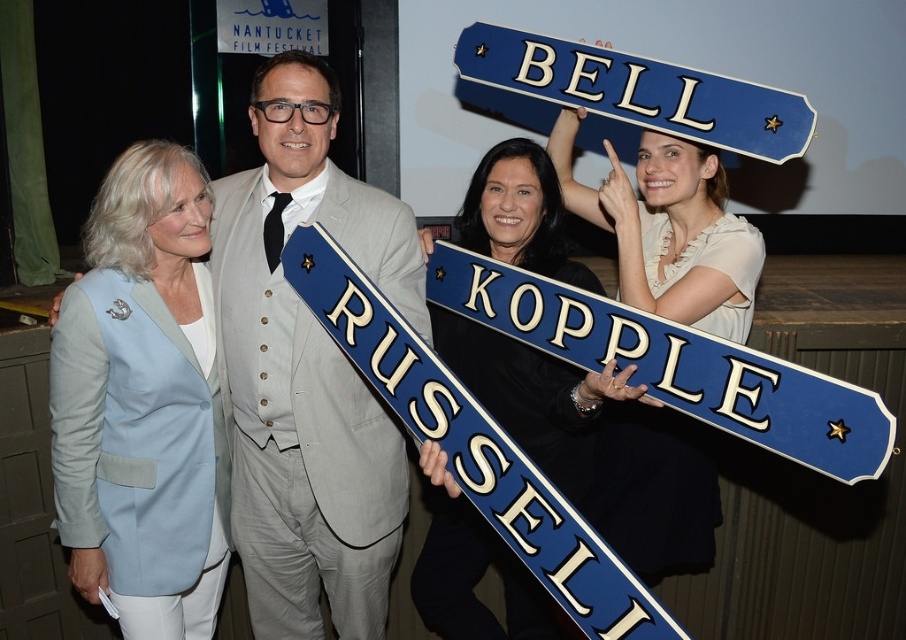
Is light blue fabric jacket at left wider than blue satin sash at center?

No.

Can you confirm if light blue fabric jacket at left is smaller than blue satin sash at center?

Yes, light blue fabric jacket at left is smaller than blue satin sash at center.

The image size is (906, 640). What do you see at coordinates (142, 401) in the screenshot? I see `light blue fabric jacket at left` at bounding box center [142, 401].

Locate an element on the screen. The width and height of the screenshot is (906, 640). light blue fabric jacket at left is located at coordinates (142, 401).

Who is lower down, blue satin sash at center or blue painted wood street sign at upper center?

blue satin sash at center is below.

Which is more to the right, blue satin sash at center or blue painted wood street sign at upper center?

blue painted wood street sign at upper center

Is point (455, 348) in front of point (488, 36)?

Yes.

Identify the location of blue satin sash at center. The image size is (906, 640). (532, 396).

Is blue painted wood street sign at center to the left of blue painted wood street sign at upper center from the viewer's perspective?

Indeed, blue painted wood street sign at center is positioned on the left side of blue painted wood street sign at upper center.

Which is above, blue painted wood street sign at center or blue painted wood street sign at upper center?

blue painted wood street sign at upper center is above.

Is point (618, 301) positioned before point (596, 145)?

Yes, point (618, 301) is closer to viewer.

The height and width of the screenshot is (640, 906). Identify the location of blue painted wood street sign at center. (676, 364).